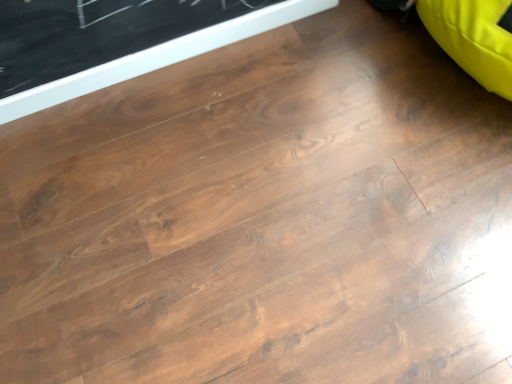
Measure the distance between matte wood bulletin board at upper left and camera.

matte wood bulletin board at upper left and camera are 4.02 feet apart from each other.

This screenshot has height=384, width=512. Describe the element at coordinates (158, 57) in the screenshot. I see `matte wood bulletin board at upper left` at that location.

In order to face matte wood bulletin board at upper left, should I rotate leftwards or rightwards?

Turn left approximately 10.669 degrees to face it.

Locate an element on the screen. The height and width of the screenshot is (384, 512). matte wood bulletin board at upper left is located at coordinates (158, 57).

Where is `matte wood bulletin board at upper left`? matte wood bulletin board at upper left is located at coordinates (158, 57).